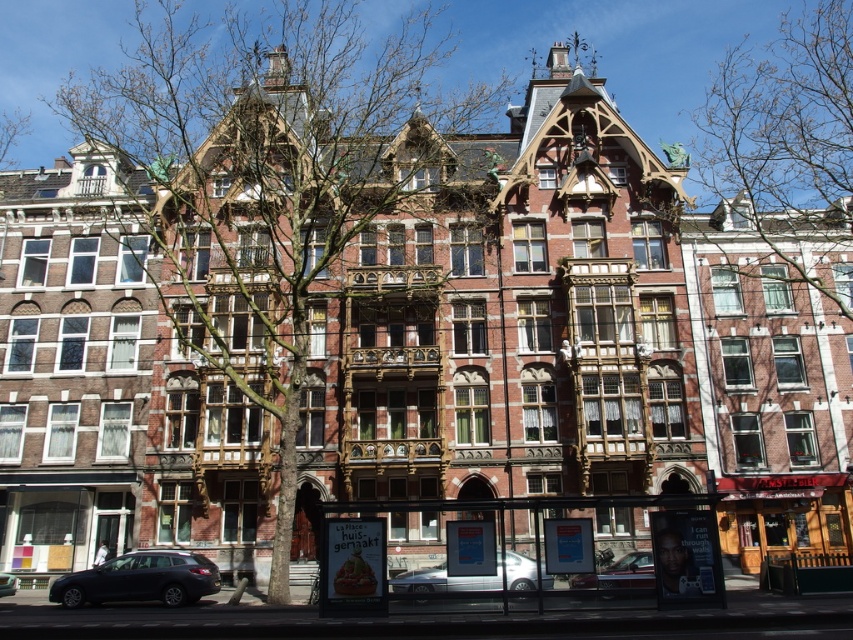
Is bare branches at upper center taller than bare branches at upper left?

Yes.

Is point (822, 99) positioned before point (18, 131)?

Yes, it is in front of point (18, 131).

Is point (695, 113) in front of point (22, 129)?

Yes, it is.

The height and width of the screenshot is (640, 853). I want to click on bare branches at upper center, so click(787, 144).

Who is shorter, bare branches at upper center or matte black car at lower left?

matte black car at lower left

Does bare branches at upper center appear under matte black car at lower left?

No.

The width and height of the screenshot is (853, 640). Identify the location of bare branches at upper center. (787, 144).

Does matte black car at lower left have a smaller size compared to bare branches at upper left?

Correct, matte black car at lower left occupies less space than bare branches at upper left.

Between point (119, 557) and point (3, 156), which one is positioned behind?

The point (3, 156) is more distant.

Identify the location of matte black car at lower left. (138, 579).